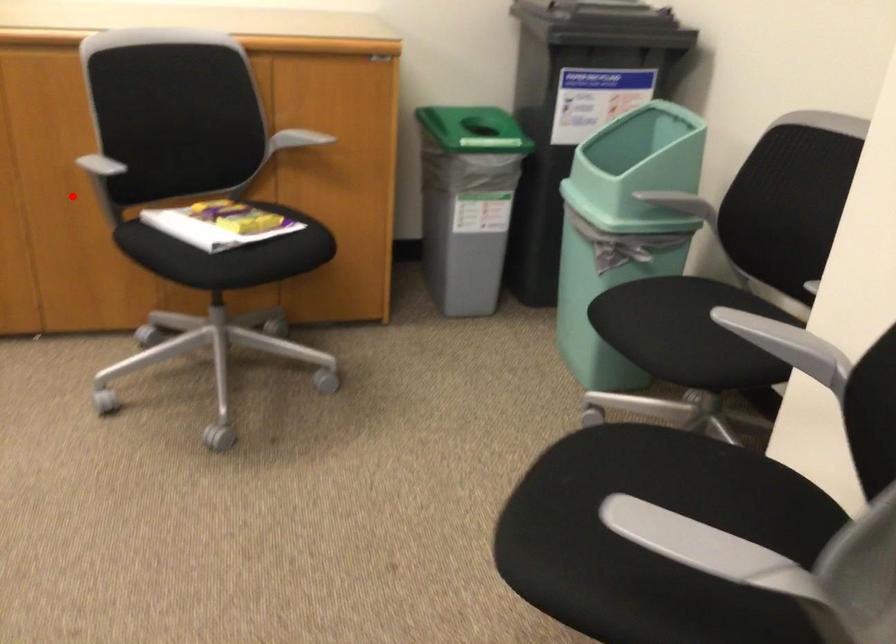
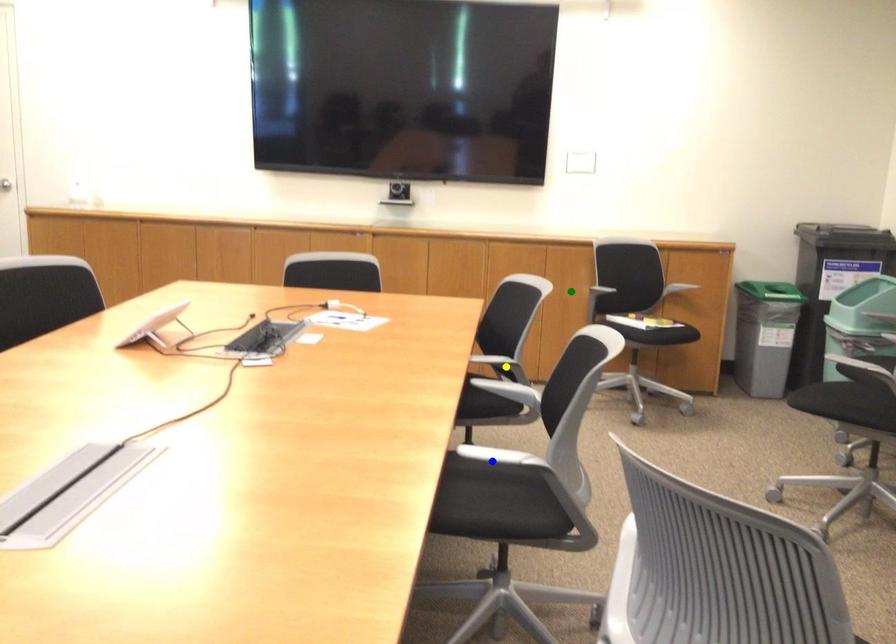
Question: I am providing you with two images of the same scene from different viewpoints. A red point is marked on the first image. You are given multiple points on the second image. Can you choose the point in image 2 that corresponds to the point in image 1?

Choices:
 (A) green point
 (B) yellow point
 (C) blue point

Answer: (A)